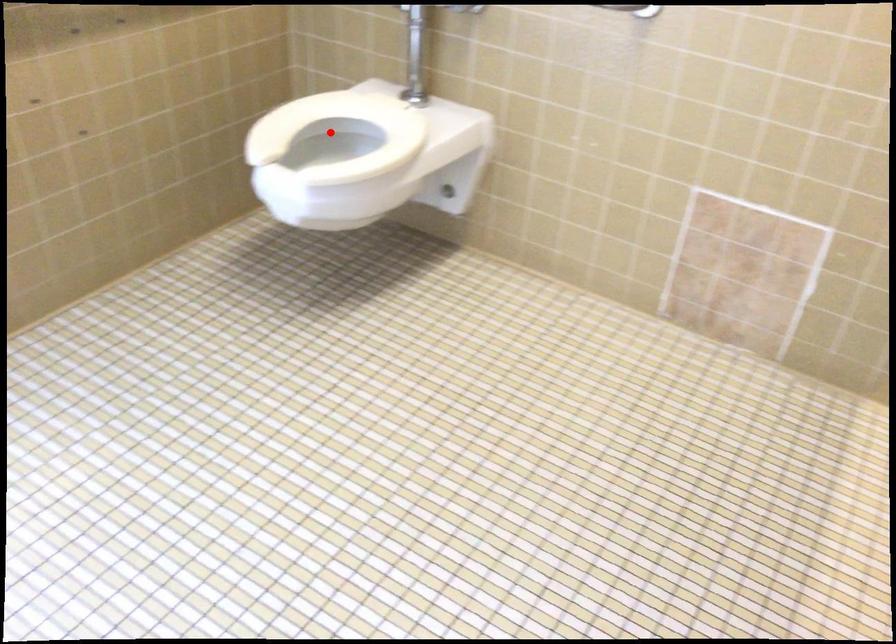
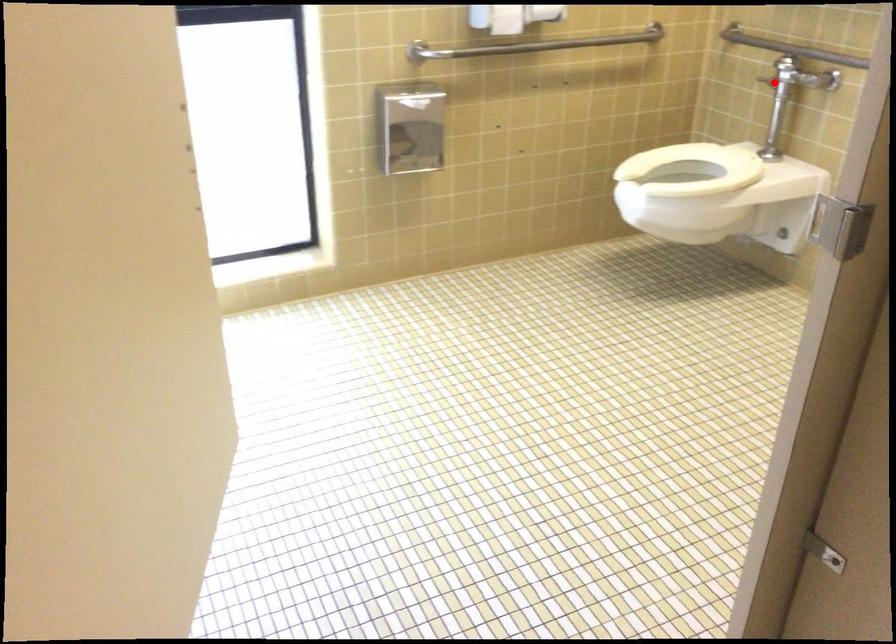
Consider the image. I am providing you with two images of the same scene from different viewpoints. A red point is marked on the first image and another point is marked on the second image. Is the red point in image1 aligned with the point shown in image2?

No